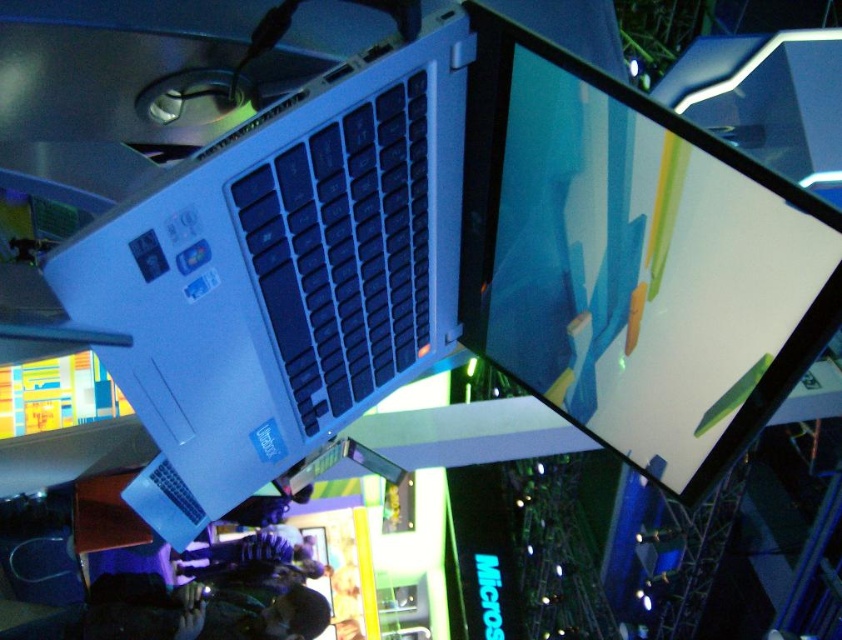
You are at a tech exhibition and see the satin white laptop at upper center and the matte black screen at upper center. Which object takes up more space in the image?

The satin white laptop at upper center is larger in size than the matte black screen at upper center, so it takes up more space in the image.

You are a photographer at a tech show, and you want to capture the satin white laptop at upper center. The camera you are using has a focal length of 50mm and an aperture of f2.8. The camera is positioned at point A, which is 2 meters away from the laptop. To ensure the laptop is in focus, you need to calculate the hyperfocal distance. What is the hyperfocal distance required to keep the laptop sharp in the photo?

The hyperfocal distance calculation requires knowing the circle of confusion for the camera sensor, which isn not provided in the scene description. Without this information, it is not possible to accurately determine the hyperfocal distance needed to keep the satin white laptop at upper center sharp.